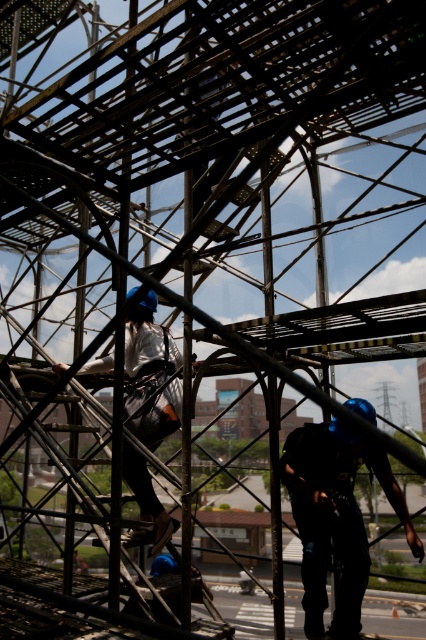
Does metallic scaffolding at center appear over matte white shirt at center?

Incorrect, metallic scaffolding at center is not positioned above matte white shirt at center.

Is point (14, 568) farther from camera compared to point (86, 364)?

Yes, point (14, 568) is farther from viewer.

Is point (180, 636) farther from viewer compared to point (152, 352)?

No, (180, 636) is closer to viewer.

Locate an element on the screen. This screenshot has width=426, height=640. metallic scaffolding at center is located at coordinates (94, 612).

Which is below, shiny blue helmet at center or matte white shirt at center?

shiny blue helmet at center is below.

Which is behind, point (348, 588) or point (131, 534)?

Positioned behind is point (348, 588).

Locate an element on the screen. shiny blue helmet at center is located at coordinates (336, 518).

Does metallic scaffolding at center have a lesser height compared to shiny blue helmet at center?

Incorrect, metallic scaffolding at center's height does not fall short of shiny blue helmet at center's.

At what (x,y) coordinates should I click in order to perform the action: click on metallic scaffolding at center. Please return your answer as a coordinate pair (x, y). This screenshot has height=640, width=426. Looking at the image, I should click on (94, 612).